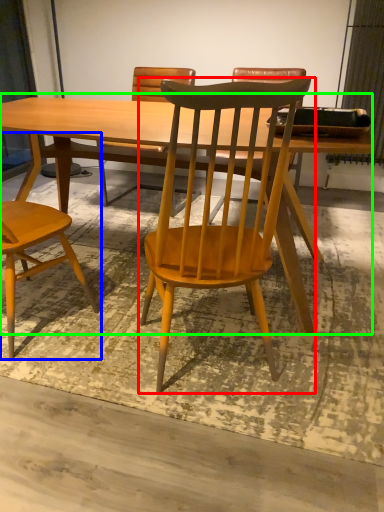
Question: Which object is the farthest from chair (highlighted by a red box)? Choose among these: chair (highlighted by a blue box) or table (highlighted by a green box).

Choices:
 (A) chair
 (B) table

Answer: (A)